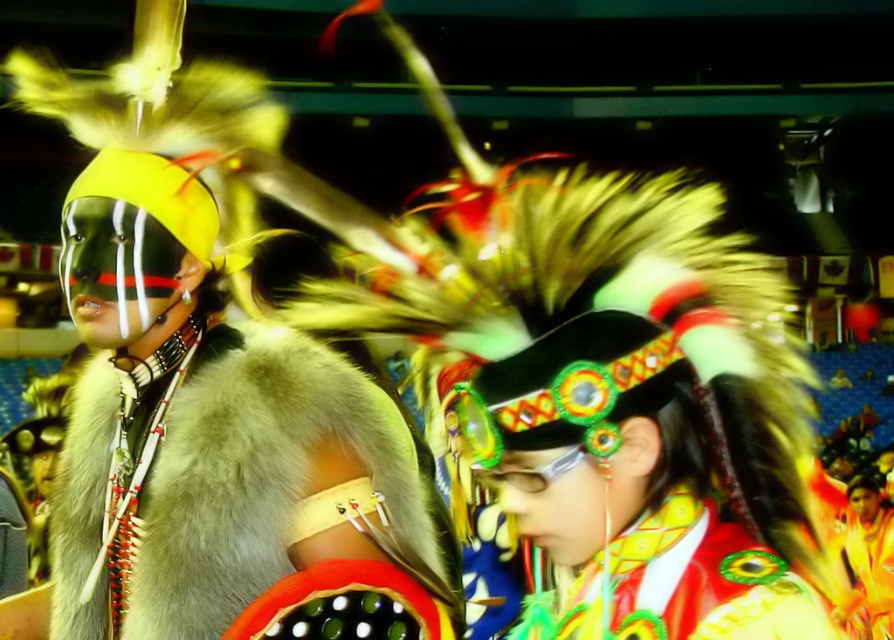
Question: Considering the relative positions of fur at left and shiny yellow fabric headdress at center in the image provided, where is fur at left located with respect to shiny yellow fabric headdress at center?

Choices:
 (A) below
 (B) above

Answer: (A)

Question: Which point appears farthest from the camera in this image?

Choices:
 (A) (770, 582)
 (B) (313, 436)

Answer: (B)

Question: Is fur at left positioned before shiny yellow fabric headdress at center?

Choices:
 (A) no
 (B) yes

Answer: (A)

Question: Which point is closer to the camera?

Choices:
 (A) fur at left
 (B) shiny yellow fabric headdress at center

Answer: (B)

Question: Is fur at left closer to camera compared to shiny yellow fabric headdress at center?

Choices:
 (A) yes
 (B) no

Answer: (B)